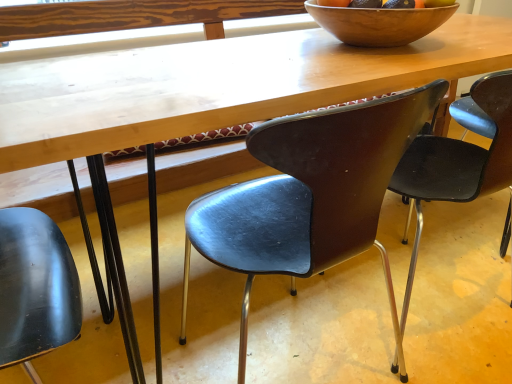
Question: Considering the relative positions of wooden bowl at upper center and matte brown chair at upper right, which is the third chair in left-to-right order, in the image provided, is wooden bowl at upper center to the left of matte brown chair at upper right, which is the third chair in left-to-right order, from the viewer's perspective?

Choices:
 (A) no
 (B) yes

Answer: (B)

Question: Is wooden bowl at upper center positioned with its back to matte brown chair at upper right, which is the third chair in left-to-right order?

Choices:
 (A) no
 (B) yes

Answer: (A)

Question: Could matte brown chair at upper right, the first chair from the right, be considered to be inside wooden bowl at upper center?

Choices:
 (A) yes
 (B) no

Answer: (B)

Question: Does wooden bowl at upper center have a greater width compared to matte brown chair at upper right, the first chair from the right?

Choices:
 (A) yes
 (B) no

Answer: (B)

Question: Considering the relative sizes of wooden bowl at upper center and matte brown chair at upper right, the first chair from the right, in the image provided, is wooden bowl at upper center bigger than matte brown chair at upper right, the first chair from the right,?

Choices:
 (A) yes
 (B) no

Answer: (B)

Question: Based on their sizes in the image, would you say matte brown chair at upper right, which is the third chair in left-to-right order, is bigger or smaller than wooden bowl at upper center?

Choices:
 (A) small
 (B) big

Answer: (B)

Question: Visually, is matte brown chair at upper right, which is the third chair in left-to-right order, positioned to the left or to the right of wooden bowl at upper center?

Choices:
 (A) left
 (B) right

Answer: (B)

Question: Is point (445, 165) positioned closer to the camera than point (325, 8)?

Choices:
 (A) closer
 (B) farther

Answer: (B)

Question: Is matte brown chair at upper right, which is the third chair in left-to-right order, situated inside wooden bowl at upper center or outside?

Choices:
 (A) inside
 (B) outside

Answer: (B)

Question: Considering the relative positions of matte black chair at center, arranged as the second chair when viewed from the left, and matte black chair at lower left, which is counted as the first chair, starting from the left, in the image provided, is matte black chair at center, arranged as the second chair when viewed from the left, to the left or to the right of matte black chair at lower left, which is counted as the first chair, starting from the left,?

Choices:
 (A) left
 (B) right

Answer: (B)

Question: Considering their positions, is matte black chair at center, the second chair viewed from the right, located in front of or behind matte black chair at lower left, which is counted as the first chair, starting from the left?

Choices:
 (A) front
 (B) behind

Answer: (B)

Question: Is point (241, 322) positioned closer to the camera than point (14, 317)?

Choices:
 (A) farther
 (B) closer

Answer: (A)

Question: From the image's perspective, is matte black chair at center, the second chair viewed from the right, above or below matte black chair at lower left, which is counted as the first chair, starting from the left?

Choices:
 (A) below
 (B) above

Answer: (B)

Question: Choose the correct answer: Is matte black chair at center, arranged as the second chair when viewed from the left, inside matte brown chair at upper right, which is the third chair in left-to-right order, or outside it?

Choices:
 (A) inside
 (B) outside

Answer: (B)

Question: In terms of height, does matte black chair at center, the second chair viewed from the right, look taller or shorter compared to matte brown chair at upper right, the first chair from the right?

Choices:
 (A) tall
 (B) short

Answer: (A)